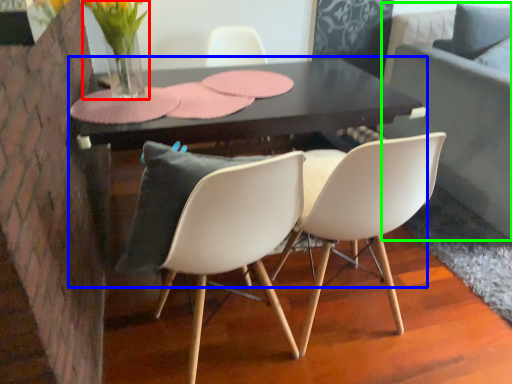
Question: Which is farther away from floral arrangement (highlighted by a red box)? table (highlighted by a blue box) or couch (highlighted by a green box)?

Choices:
 (A) table
 (B) couch

Answer: (B)